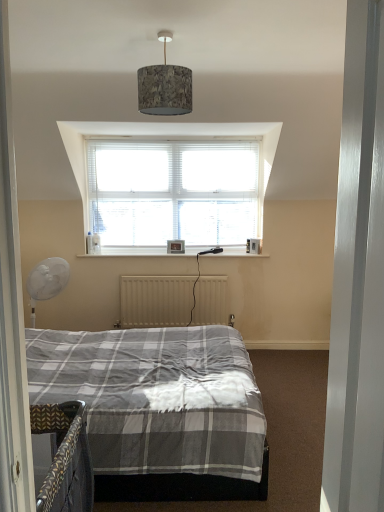
Question: Is point (375, 417) closer or farther from the camera than point (200, 282)?

Choices:
 (A) closer
 (B) farther

Answer: (A)

Question: In the image, is metallic silver door at right positioned in front of or behind beige metallic radiator at center?

Choices:
 (A) front
 (B) behind

Answer: (A)

Question: Which object is positioned farthest from the wooden picture frame at center?

Choices:
 (A) beige metallic radiator at center
 (B) metallic silver door at right
 (C) textured fabric lampshade at upper center

Answer: (B)

Question: Based on their relative distances, which object is farther from the metallic silver door at right?

Choices:
 (A) textured fabric lampshade at upper center
 (B) wooden picture frame at center
 (C) beige metallic radiator at center

Answer: (B)